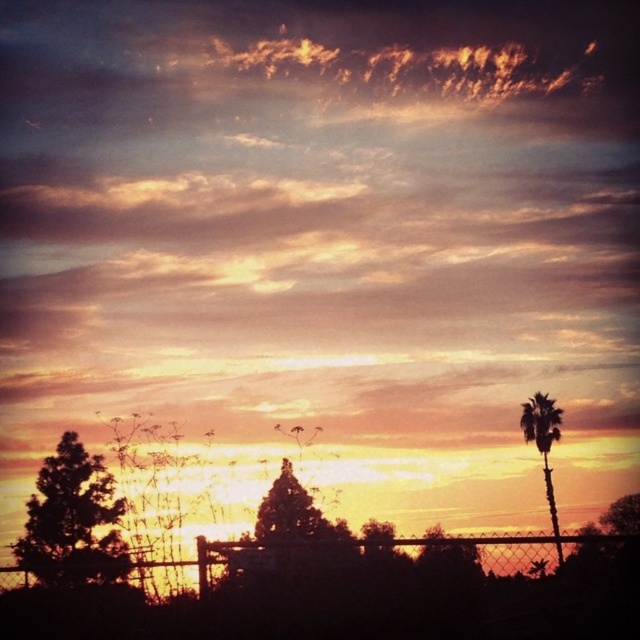
Question: Estimate the real-world distances between objects in this image. Which object is farther from the golden textured clouds at upper center?

Choices:
 (A) silhouette palm tree at right
 (B) green leafy tree at lower left

Answer: (B)

Question: Which point is farther from the camera taking this photo?

Choices:
 (A) (435, 563)
 (B) (128, 355)

Answer: (B)

Question: Can you confirm if golden textured clouds at upper center is smaller than silhouette palm tree at right?

Choices:
 (A) yes
 (B) no

Answer: (A)

Question: Does golden textured clouds at upper center appear under wire mesh fence at lower center?

Choices:
 (A) yes
 (B) no

Answer: (B)

Question: Which is nearer to the golden textured clouds at upper center?

Choices:
 (A) green leafy tree at lower left
 (B) silhouette palm tree at right
 (C) wire mesh fence at lower center

Answer: (B)

Question: Considering the relative positions of golden textured clouds at upper center and silhouette palm tree at right in the image provided, where is golden textured clouds at upper center located with respect to silhouette palm tree at right?

Choices:
 (A) right
 (B) left

Answer: (B)